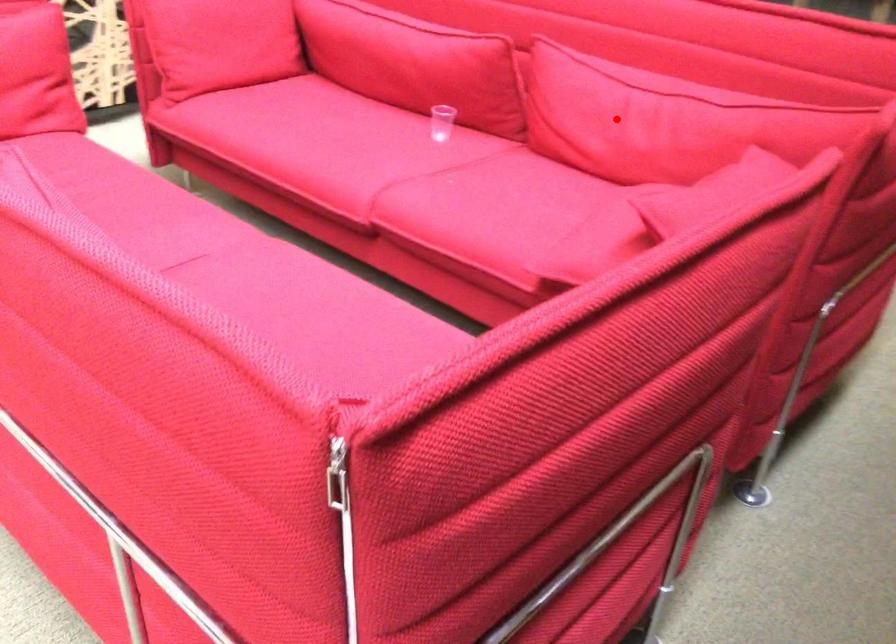
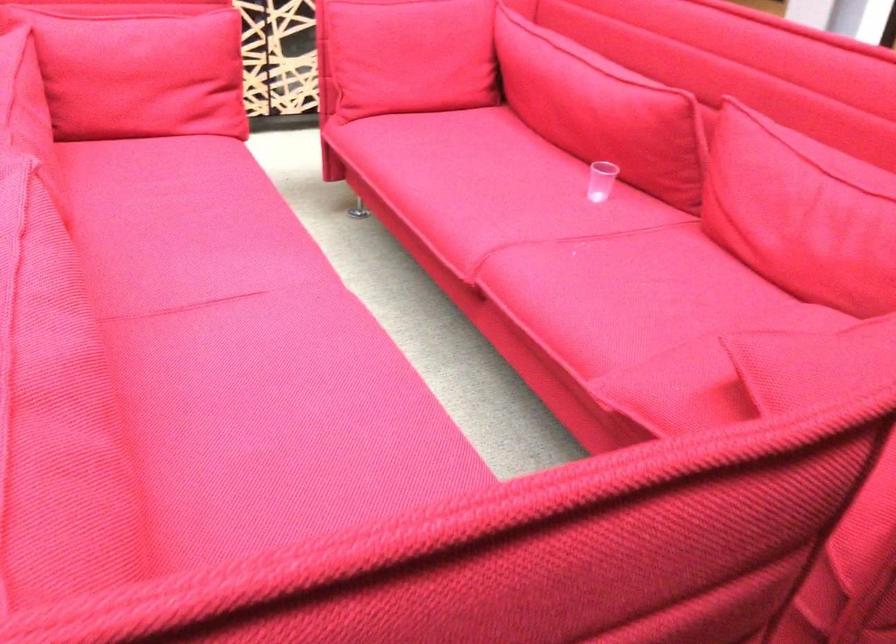
Question: A red point is marked in image1. In image2, is the corresponding 3D point closer to the camera or farther? Reply with the corresponding letter.

Choices:
 (A) The corresponding 3D point is closer.
 (B) The corresponding 3D point is farther.

Answer: (A)